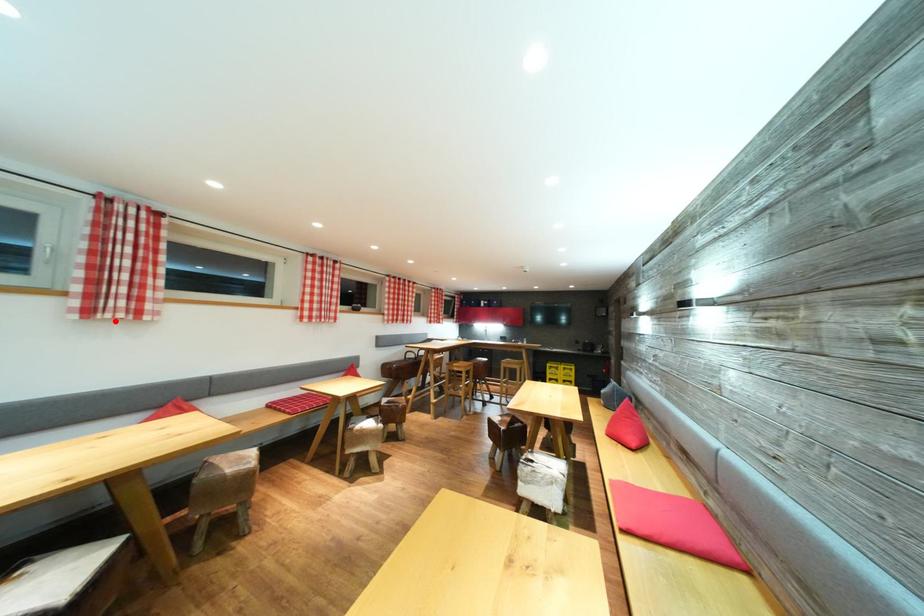
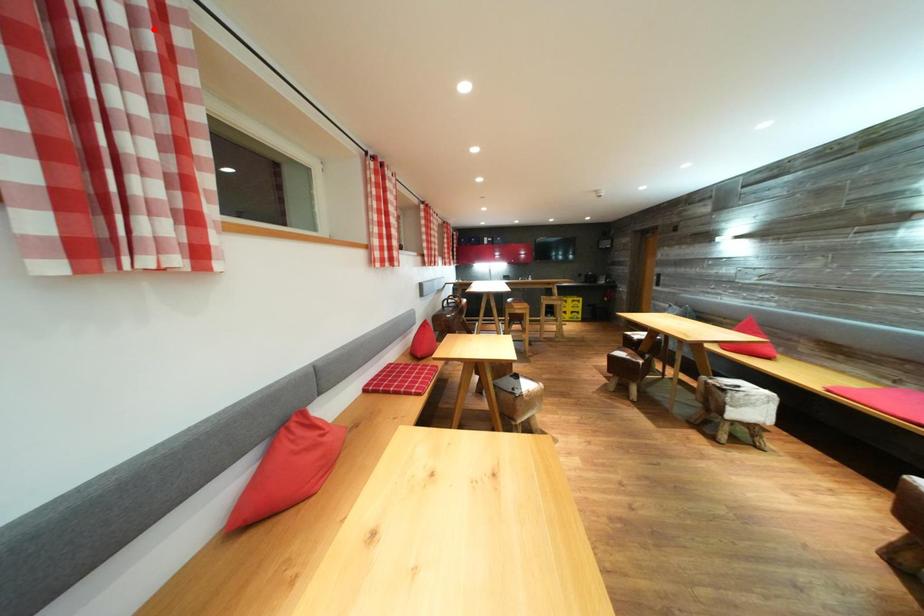
I am providing you with two images of the same scene from different viewpoints. A red point is marked on the first image and another point is marked on the second image. Is the marked point in image1 the same physical position as the marked point in image2?

No